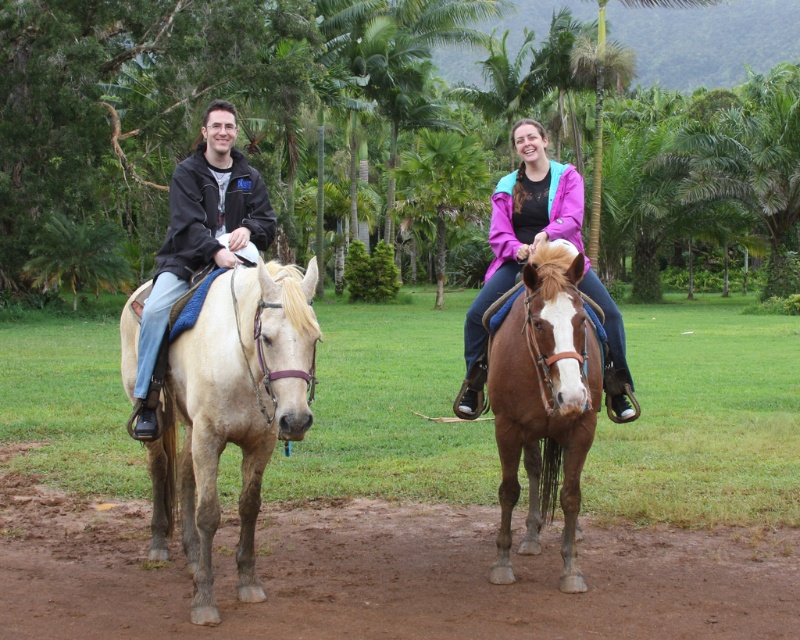
Does brown leather horse at center come in front of matte black jacket at left?

That is True.

The height and width of the screenshot is (640, 800). In order to click on brown leather horse at center in this screenshot , I will do `click(544, 403)`.

I want to click on brown leather horse at center, so [x=544, y=403].

Between brown dirt track at lower center and matte black jacket at left, which one is positioned higher?

matte black jacket at left

Between point (721, 529) and point (220, 134), which one is positioned behind?

Point (721, 529)

Is point (24, 477) closer to camera compared to point (141, 403)?

No, (24, 477) is behind (141, 403).

You are a GUI agent. You are given a task and a screenshot of the screen. Output one action in this format:
    pyautogui.click(x=<x>, y=<y>)
    Task: Click on the brown dirt track at lower center
    The width and height of the screenshot is (800, 640).
    Given the screenshot: What is the action you would take?
    pyautogui.click(x=380, y=573)

Is brown dirt track at lower center to the right of brown leather horse at center from the viewer's perspective?

Incorrect, brown dirt track at lower center is not on the right side of brown leather horse at center.

Is point (100, 534) closer to camera compared to point (588, 404)?

No, (100, 534) is behind (588, 404).

What do you see at coordinates (380, 573) in the screenshot? Image resolution: width=800 pixels, height=640 pixels. I see `brown dirt track at lower center` at bounding box center [380, 573].

Where is `brown dirt track at lower center`? This screenshot has width=800, height=640. brown dirt track at lower center is located at coordinates (380, 573).